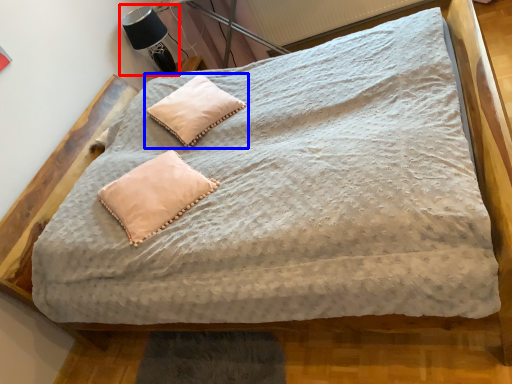
Question: Which object appears farthest to the camera in this image, table lamp (highlighted by a red box) or pillow (highlighted by a blue box)?

Choices:
 (A) table lamp
 (B) pillow

Answer: (A)